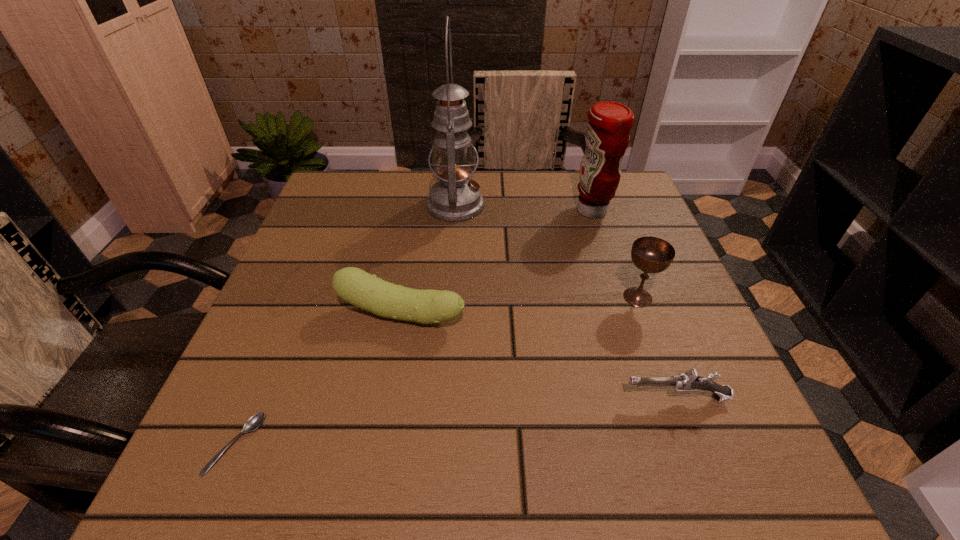
Identify the location of soupspoon that is at the left edge. Image resolution: width=960 pixels, height=540 pixels. (255, 421).

Locate an element on the screen. The height and width of the screenshot is (540, 960). condiment situated at the right edge is located at coordinates (607, 136).

The width and height of the screenshot is (960, 540). I want to click on chalice located at the right edge, so click(649, 254).

I want to click on gun at the right edge, so click(x=687, y=382).

Identify the location of object that is at the near left corner. (255, 421).

Find the location of a particular element. This screenshot has width=960, height=540. object present at the far right corner is located at coordinates click(x=607, y=136).

In the image, there is a desktop. At what (x,y) coordinates should I click in order to perform the action: click on free space at the far edge. Please return your answer as a coordinate pair (x, y). Looking at the image, I should click on (423, 191).

The width and height of the screenshot is (960, 540). Identify the location of free space at the near edge. (372, 452).

In the image, there is a desktop. Find the location of `vacant space at the left edge`. vacant space at the left edge is located at coordinates (270, 332).

This screenshot has width=960, height=540. In the image, there is a desktop. Identify the location of vacant space at the right edge. (699, 343).